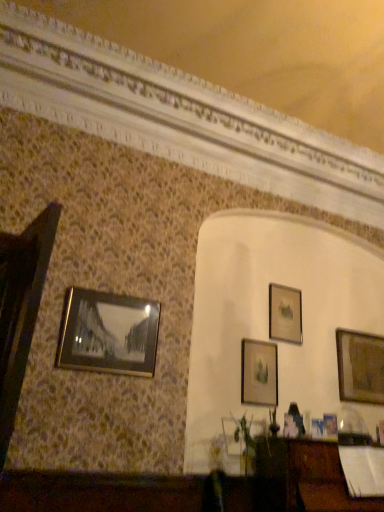
This screenshot has height=512, width=384. Describe the element at coordinates (108, 333) in the screenshot. I see `metallic gold picture frame at left, which is counted as the first picture frame, starting from the left` at that location.

Measure the distance between point (326, 418) and camera.

The depth of point (326, 418) is 10.21 feet.

You are a GUI agent. You are given a task and a screenshot of the screen. Output one action in this format:
    pyautogui.click(x=<x>, y=<y>)
    Task: Click on the wooden picture frame at right, marked as the fifth picture frame in a left-to-right arrangement
    This screenshot has height=512, width=384.
    Given the screenshot: What is the action you would take?
    pyautogui.click(x=360, y=367)

Where is `the 2nd picture frame positioned below the matte gold picture frame at center, acting as the 2th picture frame starting from the left (from the image's perspective)`? the 2nd picture frame positioned below the matte gold picture frame at center, acting as the 2th picture frame starting from the left (from the image's perspective) is located at coordinates (330, 425).

Is matte gold picture frame at center, the third picture frame from the back, not close to metallic gold picture frame at lower right, which is the 2th picture frame from front to back?

Actually, matte gold picture frame at center, the third picture frame from the back, and metallic gold picture frame at lower right, which is the 2th picture frame from front to back, are a little close together.

Which of these two, matte gold picture frame at center, arranged as the 3th picture frame when viewed from the front, or metallic gold picture frame at lower right, acting as the fourth picture frame starting from the left, is bigger?

Bigger between the two is matte gold picture frame at center, arranged as the 3th picture frame when viewed from the front.

Considering the relative positions of matte gold picture frame at center, arranged as the 3th picture frame when viewed from the front, and metallic gold picture frame at lower right, the fourth picture frame when ordered from back to front, in the image provided, is matte gold picture frame at center, arranged as the 3th picture frame when viewed from the front, to the left of metallic gold picture frame at lower right, the fourth picture frame when ordered from back to front, from the viewer's perspective?

Indeed, matte gold picture frame at center, arranged as the 3th picture frame when viewed from the front, is positioned on the left side of metallic gold picture frame at lower right, the fourth picture frame when ordered from back to front.

Measure the distance between matte gold picture frame at center, the third picture frame from the back, and metallic gold picture frame at left, which is counted as the first picture frame, starting from the left.

The distance of matte gold picture frame at center, the third picture frame from the back, from metallic gold picture frame at left, which is counted as the first picture frame, starting from the left, is 3.42 feet.

Considering the positions of points (265, 380) and (82, 341), is point (265, 380) closer to camera compared to point (82, 341)?

No, (265, 380) is further to viewer.

From a real-world perspective, between matte gold picture frame at center, the 4th picture frame from the right, and metallic gold picture frame at left, which ranks as the 5th picture frame in back-to-front order, who is vertically lower?

From a 3D spatial view, matte gold picture frame at center, the 4th picture frame from the right, is below.

Which is in front, matte gold picture frame at center, arranged as the 3th picture frame when viewed from the front, or metallic gold picture frame at left, acting as the 5th picture frame starting from the right?

metallic gold picture frame at left, acting as the 5th picture frame starting from the right.

Which object is more forward, metallic gold picture frame at lower right, the fourth picture frame when ordered from back to front, or matte gold picture frame at center, the third picture frame from the back?

Positioned in front is metallic gold picture frame at lower right, the fourth picture frame when ordered from back to front.

Considering the relative positions of metallic gold picture frame at lower right, the fourth picture frame when ordered from back to front, and matte gold picture frame at center, arranged as the 3th picture frame when viewed from the front, in the image provided, is metallic gold picture frame at lower right, the fourth picture frame when ordered from back to front, to the right of matte gold picture frame at center, arranged as the 3th picture frame when viewed from the front, from the viewer's perspective?

Indeed, metallic gold picture frame at lower right, the fourth picture frame when ordered from back to front, is positioned on the right side of matte gold picture frame at center, arranged as the 3th picture frame when viewed from the front.

Who is smaller, metallic gold picture frame at lower right, which is the second picture frame from right to left, or matte gold picture frame at center, the third picture frame from the back?

metallic gold picture frame at lower right, which is the second picture frame from right to left, is smaller.

Where is `picture frame below the matte gold picture frame at center, the 4th picture frame from the right (from a real-world perspective)`? Image resolution: width=384 pixels, height=512 pixels. picture frame below the matte gold picture frame at center, the 4th picture frame from the right (from a real-world perspective) is located at coordinates (330, 425).

Does point (266, 357) come closer to viewer compared to point (276, 288)?

Yes, it is.

From the image's perspective, is matte gold picture frame at center, acting as the 2th picture frame starting from the left, located above or below matte gold picture frame at upper right, which ranks as the third picture frame in left-to-right order?

matte gold picture frame at center, acting as the 2th picture frame starting from the left, is below matte gold picture frame at upper right, which ranks as the third picture frame in left-to-right order.

Considering the relative sizes of matte gold picture frame at center, the third picture frame from the back, and matte gold picture frame at upper right, the third picture frame in the right-to-left sequence, in the image provided, is matte gold picture frame at center, the third picture frame from the back, taller than matte gold picture frame at upper right, the third picture frame in the right-to-left sequence,?

Yes, matte gold picture frame at center, the third picture frame from the back, is taller than matte gold picture frame at upper right, the third picture frame in the right-to-left sequence.

Who is shorter, matte gold picture frame at upper right, the third picture frame in the right-to-left sequence, or wooden picture frame at right, the 1th picture frame in the back-to-front sequence?

matte gold picture frame at upper right, the third picture frame in the right-to-left sequence.

Can you confirm if matte gold picture frame at upper right, which is the 2th picture frame in back-to-front order, is smaller than wooden picture frame at right, the 1th picture frame in the back-to-front sequence?

Yes, matte gold picture frame at upper right, which is the 2th picture frame in back-to-front order, is smaller than wooden picture frame at right, the 1th picture frame in the back-to-front sequence.

From the image's perspective, which is above, matte gold picture frame at upper right, which is the 2th picture frame in back-to-front order, or wooden picture frame at right, the 1th picture frame in the back-to-front sequence?

From the image's view, matte gold picture frame at upper right, which is the 2th picture frame in back-to-front order, is above.

Measure the distance between matte gold picture frame at upper right, the third picture frame in the right-to-left sequence, and wooden picture frame at right, marked as the fifth picture frame in a left-to-right arrangement.

A distance of 24.85 inches exists between matte gold picture frame at upper right, the third picture frame in the right-to-left sequence, and wooden picture frame at right, marked as the fifth picture frame in a left-to-right arrangement.

Which object is more forward, matte gold picture frame at center, acting as the 2th picture frame starting from the left, or wooden picture frame at right, the fifth picture frame in the front-to-back sequence?

matte gold picture frame at center, acting as the 2th picture frame starting from the left, is more forward.

I want to click on the 2nd picture frame directly above the matte gold picture frame at center, the 4th picture frame from the right (from a real-world perspective), so click(360, 367).

Which object is thinner, matte gold picture frame at center, the third picture frame from the back, or wooden picture frame at right, the 1th picture frame in the back-to-front sequence?

Thinner between the two is matte gold picture frame at center, the third picture frame from the back.

Is matte gold picture frame at center, the 4th picture frame from the right, looking in the opposite direction of wooden picture frame at right, the 1th picture frame in the back-to-front sequence?

No, matte gold picture frame at center, the 4th picture frame from the right,'s orientation is not away from wooden picture frame at right, the 1th picture frame in the back-to-front sequence.

Is metallic gold picture frame at left, the 1th picture frame when ordered from front to back, at the back of metallic gold picture frame at lower right, the fourth picture frame when ordered from back to front?

That's not correct — metallic gold picture frame at lower right, the fourth picture frame when ordered from back to front, is not looking away from metallic gold picture frame at left, the 1th picture frame when ordered from front to back.

From a real-world perspective, between metallic gold picture frame at lower right, the fourth picture frame when ordered from back to front, and metallic gold picture frame at left, which is counted as the first picture frame, starting from the left, who is vertically lower?

metallic gold picture frame at lower right, the fourth picture frame when ordered from back to front, is physically lower.

From the image's perspective, is metallic gold picture frame at lower right, which is the second picture frame from right to left, located beneath metallic gold picture frame at left, the 1th picture frame when ordered from front to back?

Indeed, from the image's perspective, metallic gold picture frame at lower right, which is the second picture frame from right to left, is shown beneath metallic gold picture frame at left, the 1th picture frame when ordered from front to back.

In the scene shown: Is metallic gold picture frame at lower right, which is the 2th picture frame from front to back, bigger or smaller than metallic gold picture frame at left, which ranks as the 5th picture frame in back-to-front order?

metallic gold picture frame at lower right, which is the 2th picture frame from front to back, is smaller than metallic gold picture frame at left, which ranks as the 5th picture frame in back-to-front order.

Locate an element on the screen. This screenshot has width=384, height=512. the 1st picture frame above the metallic gold picture frame at lower right, which is the 2th picture frame from front to back (from a real-world perspective) is located at coordinates coord(259,373).

Image resolution: width=384 pixels, height=512 pixels. Find the location of `the 2nd picture frame behind when counting from the metallic gold picture frame at left, acting as the 5th picture frame starting from the right`. the 2nd picture frame behind when counting from the metallic gold picture frame at left, acting as the 5th picture frame starting from the right is located at coordinates [x=259, y=373].

Based on their spatial positions, is metallic gold picture frame at left, the 1th picture frame when ordered from front to back, or matte gold picture frame at upper right, which ranks as the third picture frame in left-to-right order, further from metallic gold picture frame at lower right, which is the second picture frame from right to left?

Among the two, metallic gold picture frame at left, the 1th picture frame when ordered from front to back, is located further to metallic gold picture frame at lower right, which is the second picture frame from right to left.

Considering their positions, is metallic gold picture frame at lower right, which is the second picture frame from right to left, positioned further to matte gold picture frame at center, the 4th picture frame from the right, than wooden picture frame at right, marked as the fifth picture frame in a left-to-right arrangement?

Based on the image, wooden picture frame at right, marked as the fifth picture frame in a left-to-right arrangement, appears to be further to matte gold picture frame at center, the 4th picture frame from the right.

Which object lies nearer to the anchor point metallic gold picture frame at lower right, which is the 2th picture frame from front to back, matte gold picture frame at upper right, which ranks as the third picture frame in left-to-right order, or matte gold picture frame at center, the third picture frame from the back?

matte gold picture frame at center, the third picture frame from the back, lies closer to metallic gold picture frame at lower right, which is the 2th picture frame from front to back, than the other object.

Estimate the real-world distances between objects in this image. Which object is further from wooden picture frame at right, the fifth picture frame in the front-to-back sequence, metallic gold picture frame at left, which is counted as the first picture frame, starting from the left, or matte gold picture frame at upper right, which is the 2th picture frame in back-to-front order?

metallic gold picture frame at left, which is counted as the first picture frame, starting from the left.

When comparing their distances from metallic gold picture frame at lower right, the fourth picture frame when ordered from back to front, does matte gold picture frame at upper right, which is the 2th picture frame in back-to-front order, or wooden picture frame at right, the first picture frame positioned from the right, seem further?

matte gold picture frame at upper right, which is the 2th picture frame in back-to-front order, is positioned further to the anchor metallic gold picture frame at lower right, the fourth picture frame when ordered from back to front.

From the image, which object appears to be nearer to metallic gold picture frame at left, acting as the 5th picture frame starting from the right, matte gold picture frame at center, the third picture frame from the back, or metallic gold picture frame at lower right, which is the second picture frame from right to left?

Based on the image, matte gold picture frame at center, the third picture frame from the back, appears to be nearer to metallic gold picture frame at left, acting as the 5th picture frame starting from the right.

When comparing their distances from wooden picture frame at right, marked as the fifth picture frame in a left-to-right arrangement, does matte gold picture frame at center, the third picture frame from the back, or metallic gold picture frame at left, which ranks as the 5th picture frame in back-to-front order, seem closer?

Among the two, matte gold picture frame at center, the third picture frame from the back, is located nearer to wooden picture frame at right, marked as the fifth picture frame in a left-to-right arrangement.

When comparing their distances from metallic gold picture frame at lower right, the fourth picture frame when ordered from back to front, does matte gold picture frame at center, the 4th picture frame from the right, or wooden picture frame at right, the 1th picture frame in the back-to-front sequence, seem further?

wooden picture frame at right, the 1th picture frame in the back-to-front sequence, is further to metallic gold picture frame at lower right, the fourth picture frame when ordered from back to front.

Locate an element on the screen. picture frame between metallic gold picture frame at left, the 1th picture frame when ordered from front to back, and matte gold picture frame at upper right, the third picture frame in the right-to-left sequence, in the horizontal direction is located at coordinates (259, 373).

What are the coordinates of `picture frame located between matte gold picture frame at upper right, which ranks as the third picture frame in left-to-right order, and wooden picture frame at right, the fifth picture frame in the front-to-back sequence, in the left-right direction` in the screenshot? It's located at (330, 425).